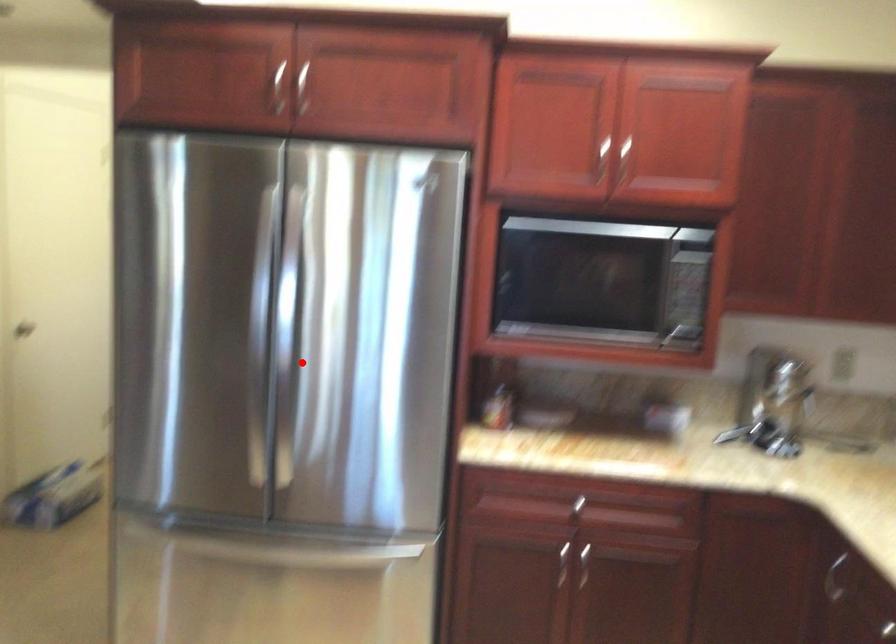
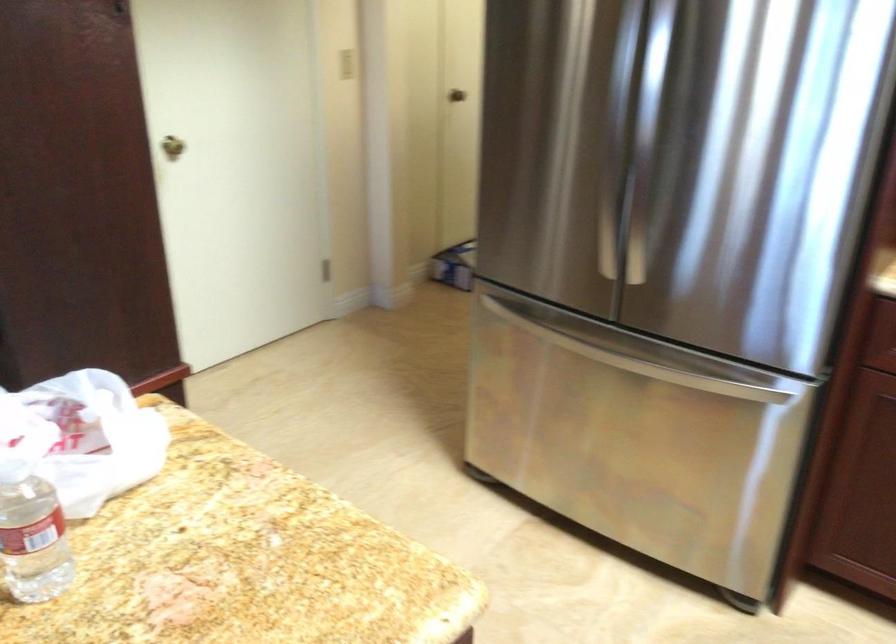
Find the pixel in the second image that matches the highlighted location in the first image.

(650, 144)